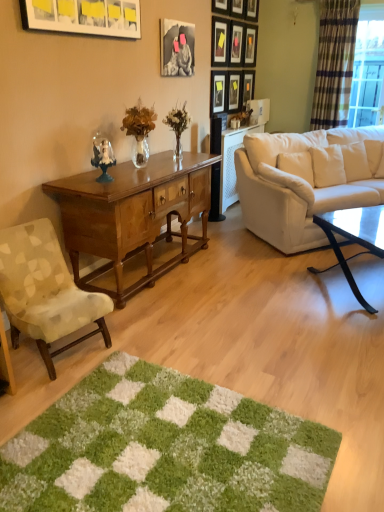
This screenshot has width=384, height=512. What are the coordinates of `free spot behind green shaggy rug at lower center` in the screenshot? It's located at (227, 337).